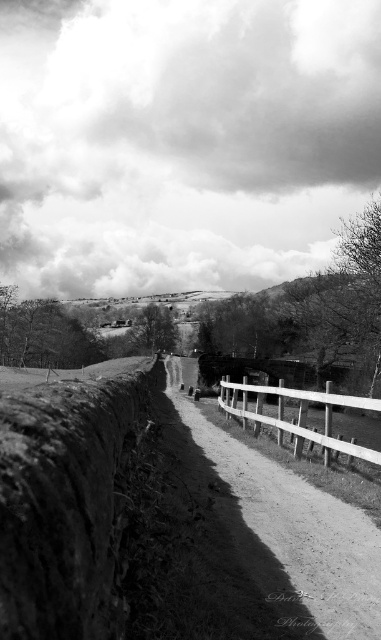
How far apart are dirt/gravel path at center and white wooden fence at center?

They are 20.72 meters apart.

Find the location of `dirt/gravel path at center`. dirt/gravel path at center is located at coordinates (275, 536).